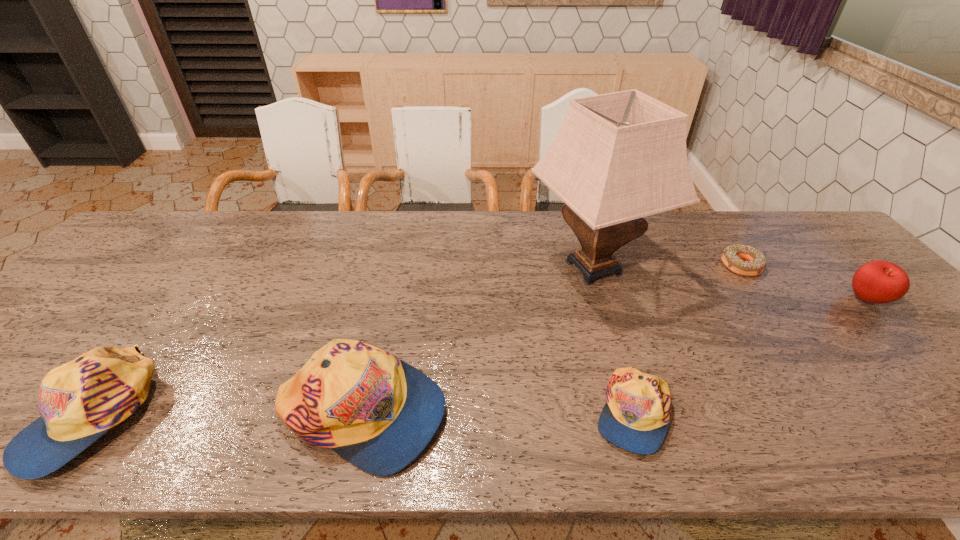
Identify the location of vacant position in the image that satisfies the following two spatial constraints: 1. on the front side of the fifth object from left to right; 2. on the bill of the second cap from right to left. This screenshot has height=540, width=960. (845, 413).

In order to click on vacant position in the image that satisfies the following two spatial constraints: 1. on the back side of the tallest object; 2. on the left side of the shortest object in this screenshot , I will do `click(592, 266)`.